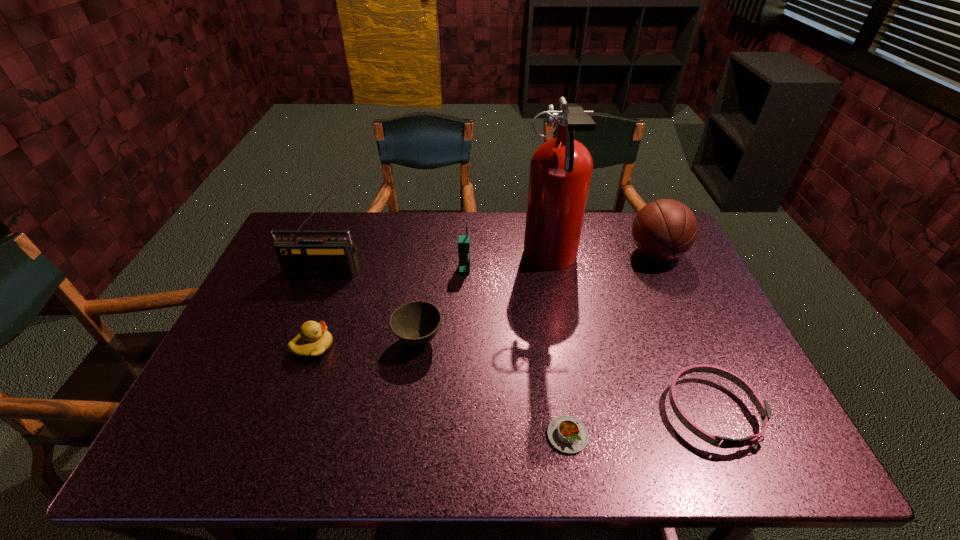
The width and height of the screenshot is (960, 540). I want to click on free space located 0.160m on the left of the basketball, so click(578, 253).

Find the location of `vacant space situated 0.180m on the keypad of the fourth object from left to right`. vacant space situated 0.180m on the keypad of the fourth object from left to right is located at coordinates (463, 318).

The image size is (960, 540). Find the location of `vacant space located on the left of the third object from left to right`. vacant space located on the left of the third object from left to right is located at coordinates (303, 340).

Locate an element on the screen. Image resolution: width=960 pixels, height=540 pixels. vacant area situated on the beak of the duckling is located at coordinates (432, 347).

I want to click on free space located on the right of the pudding, so click(748, 435).

Where is `fire extinguisher at the far edge`? fire extinguisher at the far edge is located at coordinates (561, 168).

The width and height of the screenshot is (960, 540). Find the location of `basketball that is at the far edge`. basketball that is at the far edge is located at coordinates (664, 229).

Locate an element on the screen. dog collar that is positioned at the near edge is located at coordinates (762, 406).

Locate an element on the screen. The height and width of the screenshot is (540, 960). pudding positioned at the near edge is located at coordinates (569, 435).

Where is `object located in the left edge section of the desktop`? Image resolution: width=960 pixels, height=540 pixels. object located in the left edge section of the desktop is located at coordinates (300, 257).